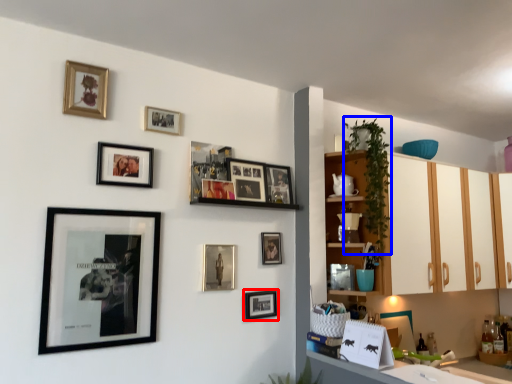
Question: Among these objects, which one is nearest to the camera, picture frame (highlighted by a red box) or plant (highlighted by a blue box)?

Choices:
 (A) picture frame
 (B) plant

Answer: (A)